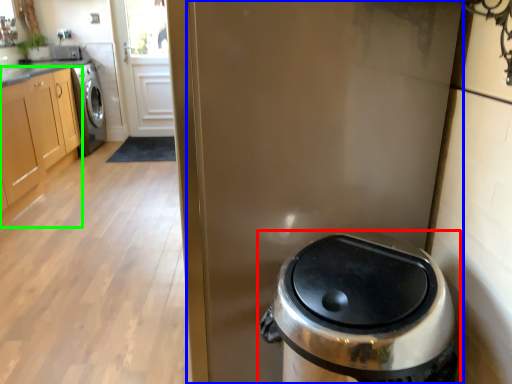
Question: Which object is positioned closest to waste container (highlighted by a red box)? Select from screen door (highlighted by a blue box) and cabinetry (highlighted by a green box).

Choices:
 (A) screen door
 (B) cabinetry

Answer: (A)